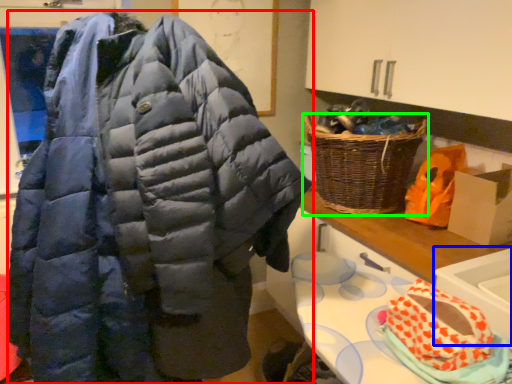
Question: Considering the real-world distances, which object is farthest from jacket (highlighted by a red box)? sink (highlighted by a blue box) or picnic basket (highlighted by a green box)?

Choices:
 (A) sink
 (B) picnic basket

Answer: (B)